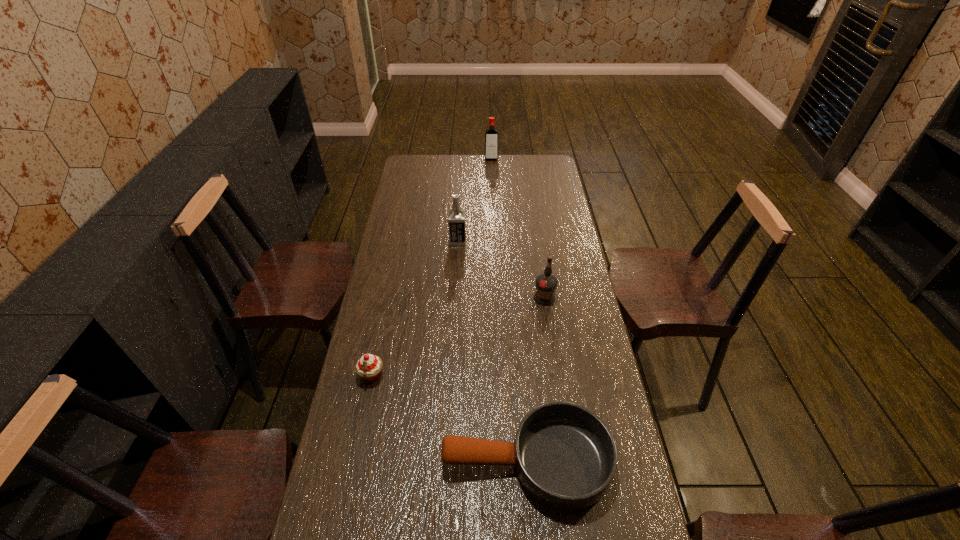
Identify the location of the second vodka from right to left. (x=491, y=145).

I want to click on the farthest vodka, so click(491, 145).

The height and width of the screenshot is (540, 960). I want to click on the leftmost vodka, so click(x=456, y=217).

At what (x,y) coordinates should I click in order to perform the action: click on the second farthest object. Please return your answer as a coordinate pair (x, y). Looking at the image, I should click on (456, 217).

Identify the location of the nearest vodka. (546, 283).

You are a GUI agent. You are given a task and a screenshot of the screen. Output one action in this format:
    pyautogui.click(x=<x>, y=<y>)
    Task: Click on the third farthest object
    The height and width of the screenshot is (540, 960).
    Given the screenshot: What is the action you would take?
    pyautogui.click(x=546, y=283)

Where is `the fourth farthest object`? the fourth farthest object is located at coordinates (368, 367).

Where is `cupcake`? cupcake is located at coordinates (368, 367).

The image size is (960, 540). I want to click on the nearest object, so click(565, 456).

This screenshot has width=960, height=540. Find the location of `the shortest object`. the shortest object is located at coordinates (565, 456).